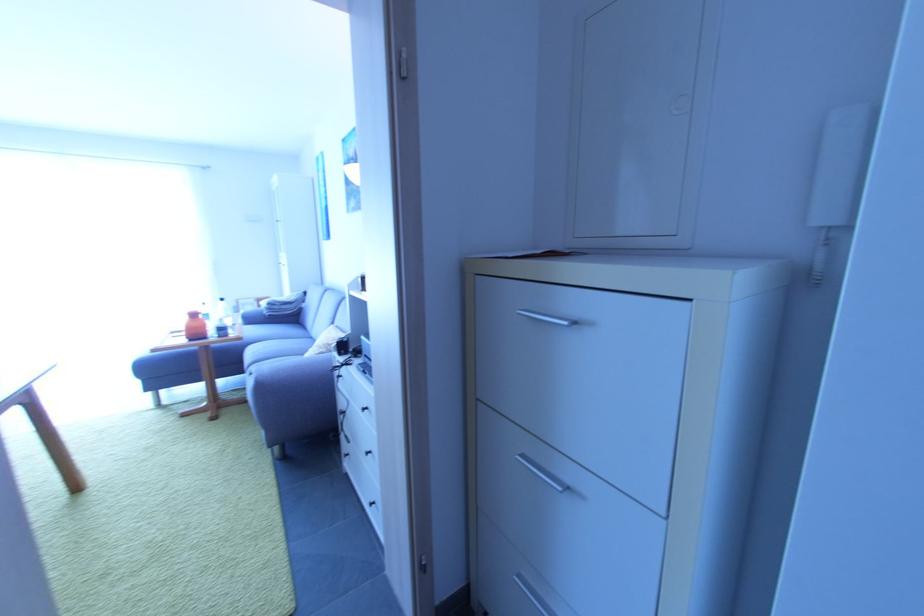
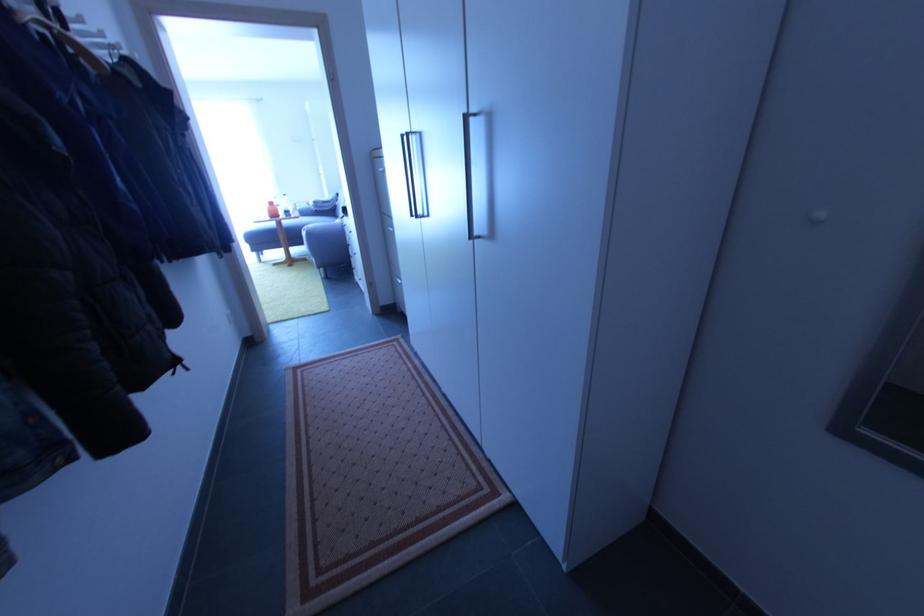
Where in the second image is the point corresponding to [256,322] from the first image?

(310, 216)